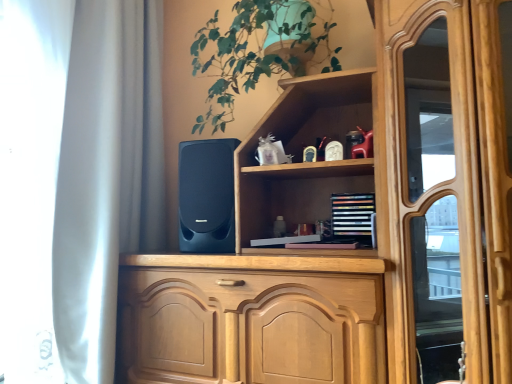
Question: Does matte black speaker at center have a greater height compared to multicolored wooden bookshelf at upper center?

Choices:
 (A) no
 (B) yes

Answer: (B)

Question: Is matte black speaker at center oriented towards multicolored wooden bookshelf at upper center?

Choices:
 (A) no
 (B) yes

Answer: (A)

Question: Is matte black speaker at center not near multicolored wooden bookshelf at upper center?

Choices:
 (A) no
 (B) yes

Answer: (A)

Question: Does matte black speaker at center touch multicolored wooden bookshelf at upper center?

Choices:
 (A) no
 (B) yes

Answer: (A)

Question: Does matte black speaker at center come in front of multicolored wooden bookshelf at upper center?

Choices:
 (A) no
 (B) yes

Answer: (B)

Question: Is green leafy plant at upper center in front of or behind matte black speaker at center in the image?

Choices:
 (A) behind
 (B) front

Answer: (B)

Question: Is green leafy plant at upper center taller or shorter than matte black speaker at center?

Choices:
 (A) tall
 (B) short

Answer: (A)

Question: Is green leafy plant at upper center wider or thinner than matte black speaker at center?

Choices:
 (A) wide
 (B) thin

Answer: (A)

Question: From the image's perspective, is green leafy plant at upper center above or below matte black speaker at center?

Choices:
 (A) above
 (B) below

Answer: (A)

Question: In terms of width, does matte black speaker at center look wider or thinner when compared to multicolored wooden bookshelf at upper center?

Choices:
 (A) wide
 (B) thin

Answer: (A)

Question: Is matte black speaker at center inside the boundaries of multicolored wooden bookshelf at upper center, or outside?

Choices:
 (A) inside
 (B) outside

Answer: (B)

Question: Relative to multicolored wooden bookshelf at upper center, is matte black speaker at center in front or behind?

Choices:
 (A) front
 (B) behind

Answer: (A)

Question: From a real-world perspective, relative to multicolored wooden bookshelf at upper center, is matte black speaker at center vertically above or below?

Choices:
 (A) below
 (B) above

Answer: (B)

Question: Considering the positions of matte black speaker at center and white matte curtain at left in the image, is matte black speaker at center bigger or smaller than white matte curtain at left?

Choices:
 (A) small
 (B) big

Answer: (A)

Question: Is point (212, 190) positioned closer to the camera than point (70, 309)?

Choices:
 (A) farther
 (B) closer

Answer: (B)